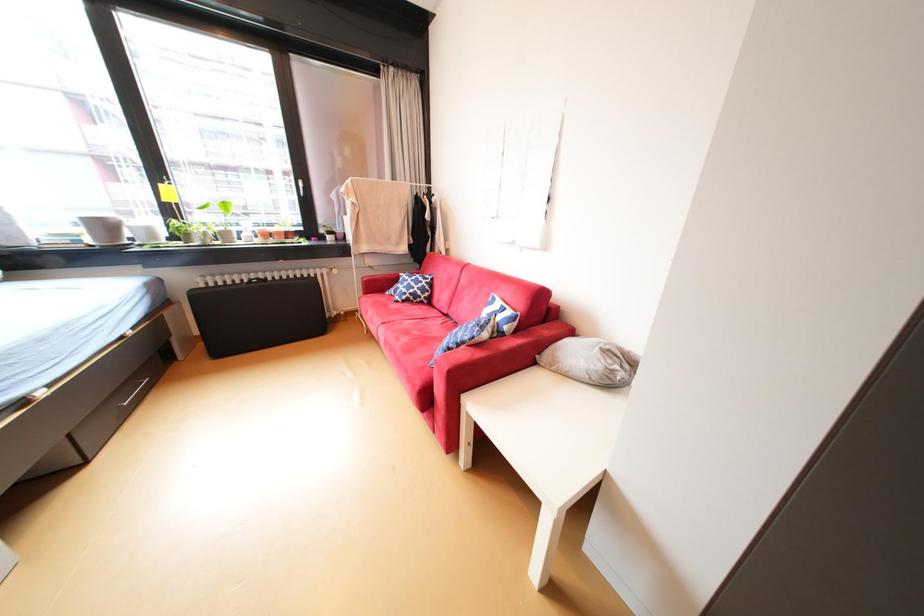
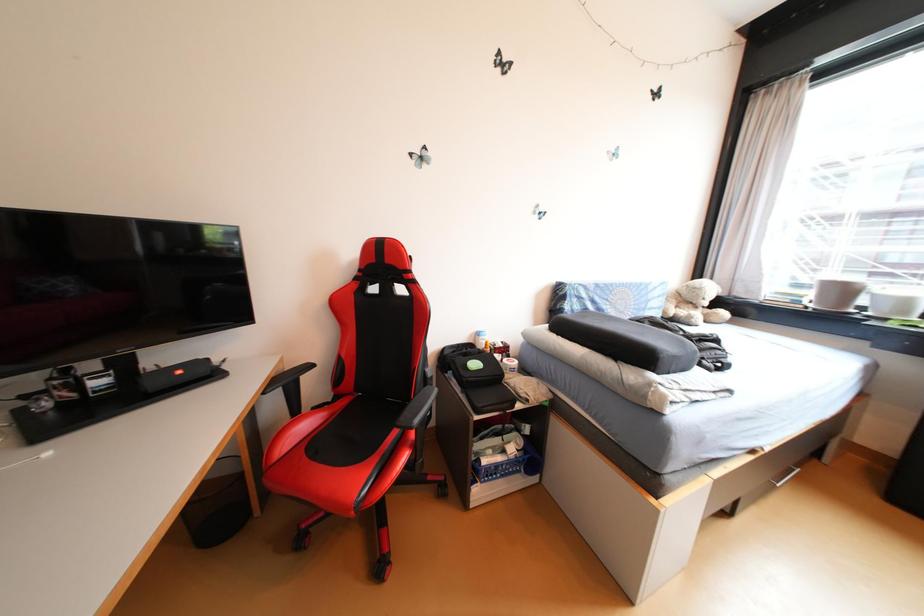
Question: The camera is either moving clockwise (left) or counter-clockwise (right) around the object. The first image is from the beginning of the video and the second image is from the end. Is the camera moving left or right when shooting the video?

Choices:
 (A) Left
 (B) Right

Answer: (B)